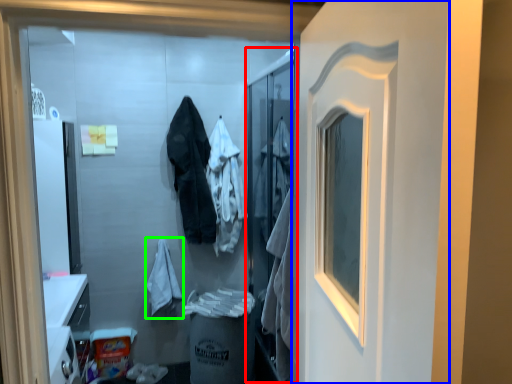
Question: Estimate the real-world distances between objects in this image. Which object is farther from screen door (highlighted by a red box), door (highlighted by a blue box) or bathrobe (highlighted by a green box)?

Choices:
 (A) door
 (B) bathrobe

Answer: (A)